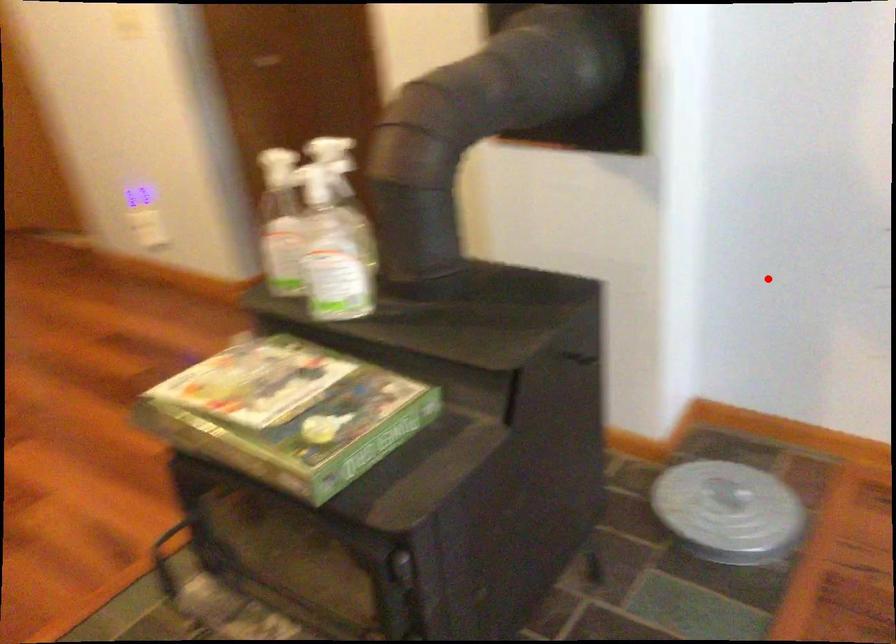
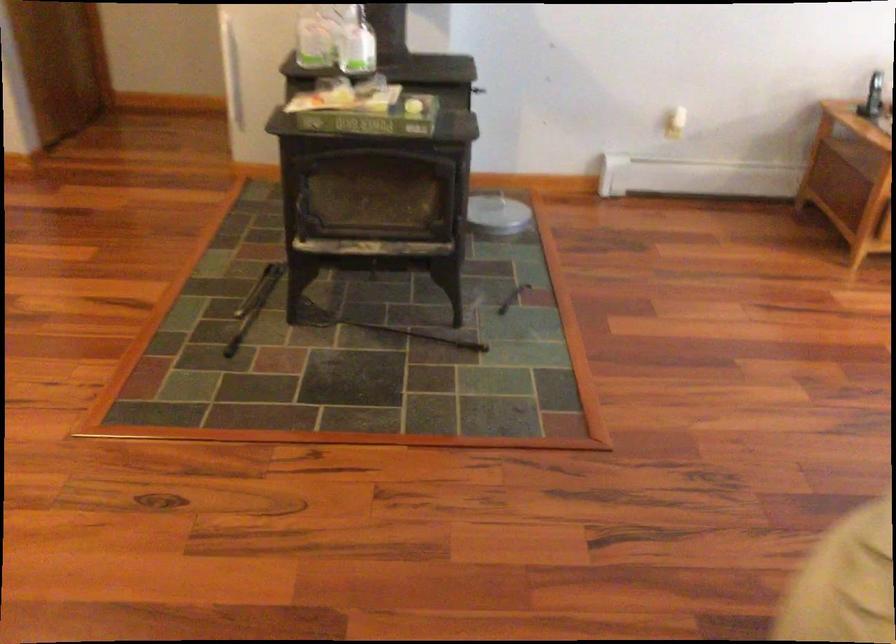
The point at the highlighted location is marked in the first image. Where is the corresponding point in the second image?

(477, 90)